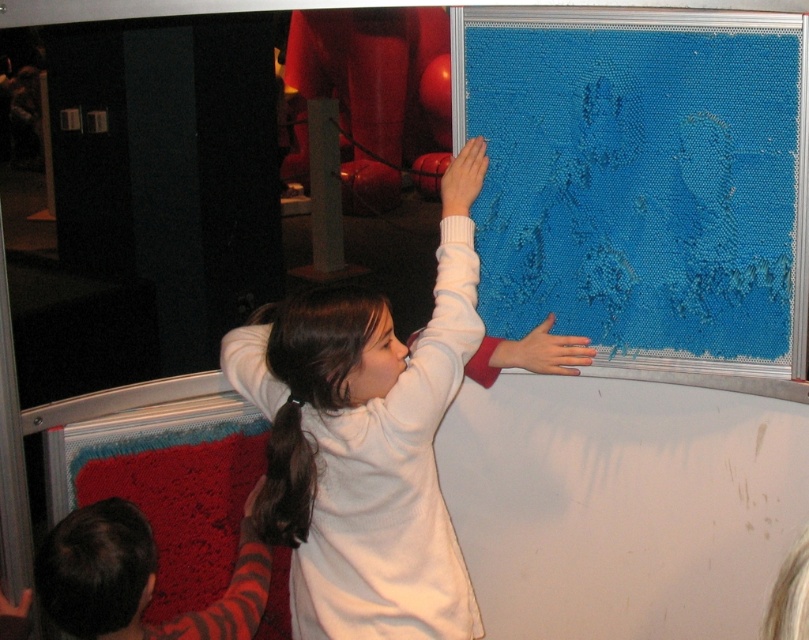
In the scene shown: You are designing a museum layout and need to place the blue textured fabric at upper right and the white matte sweater at upper center in an exhibit. Given their sizes, which object should be placed in a wider space to accommodate its size?

The blue textured fabric at upper right should be placed in a wider space because its width is larger than the white matte sweater at upper center.

You are a designer observing the exhibit and need to determine the placement of a new display. Which object, the blue textured fabric at upper right or the white matte sweater at upper center, should be placed lower to maintain visual balance?

The blue textured fabric at upper right has a lesser height compared to the white matte sweater at upper center, so placing the blue textured fabric at upper right lower would help maintain visual balance by balancing the heights of the two objects.